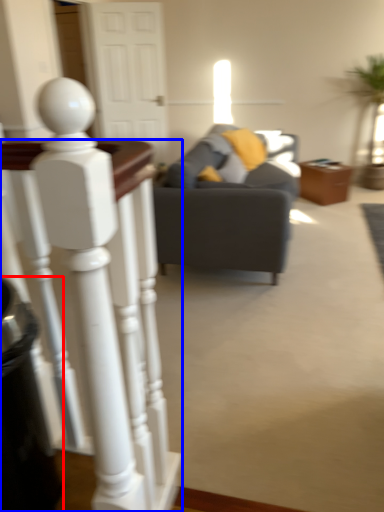
Question: Which point is further to the camera, trash bin/can (highlighted by a red box) or desk (highlighted by a blue box)?

Choices:
 (A) trash bin/can
 (B) desk

Answer: (A)